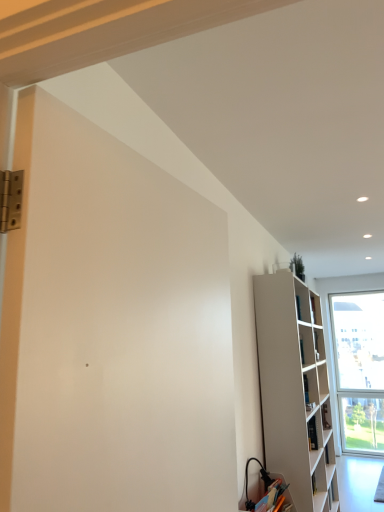
Question: Does white matte screen door at left have a lesser width compared to white matte bookshelf at right?

Choices:
 (A) yes
 (B) no

Answer: (A)

Question: Does white matte screen door at left turn towards white matte bookshelf at right?

Choices:
 (A) yes
 (B) no

Answer: (B)

Question: From a real-world perspective, is white matte screen door at left over white matte bookshelf at right?

Choices:
 (A) no
 (B) yes

Answer: (B)

Question: Can you confirm if white matte screen door at left is wider than white matte bookshelf at right?

Choices:
 (A) yes
 (B) no

Answer: (B)

Question: Is white matte screen door at left smaller than white matte bookshelf at right?

Choices:
 (A) yes
 (B) no

Answer: (A)

Question: Would you say white matte screen door at left is inside or outside matte white cabinet at lower right?

Choices:
 (A) outside
 (B) inside

Answer: (A)

Question: From the image's perspective, is white matte screen door at left above or below matte white cabinet at lower right?

Choices:
 (A) below
 (B) above

Answer: (B)

Question: From their relative heights in the image, would you say white matte screen door at left is taller or shorter than matte white cabinet at lower right?

Choices:
 (A) short
 (B) tall

Answer: (B)

Question: From a real-world perspective, relative to matte white cabinet at lower right, is white matte screen door at left vertically above or below?

Choices:
 (A) below
 (B) above

Answer: (B)

Question: Is white matte bookshelf at right taller or shorter than white matte screen door at left?

Choices:
 (A) tall
 (B) short

Answer: (A)

Question: Relative to white matte screen door at left, is white matte bookshelf at right in front or behind?

Choices:
 (A) front
 (B) behind

Answer: (B)

Question: Is white matte bookshelf at right inside the boundaries of white matte screen door at left, or outside?

Choices:
 (A) inside
 (B) outside

Answer: (B)

Question: Visually, is white matte bookshelf at right positioned to the left or to the right of white matte screen door at left?

Choices:
 (A) left
 (B) right

Answer: (B)

Question: Is point (289, 501) closer or farther from the camera than point (268, 309)?

Choices:
 (A) closer
 (B) farther

Answer: (A)

Question: Is matte white cabinet at lower right in front of or behind white matte bookshelf at right in the image?

Choices:
 (A) behind
 (B) front

Answer: (B)